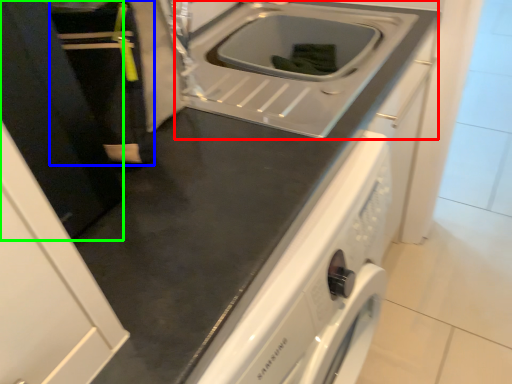
Question: Estimate the real-world distances between objects in this image. Which object is closer to sink (highlighted by a red box), person (highlighted by a blue box) or door (highlighted by a green box)?

Choices:
 (A) person
 (B) door

Answer: (A)